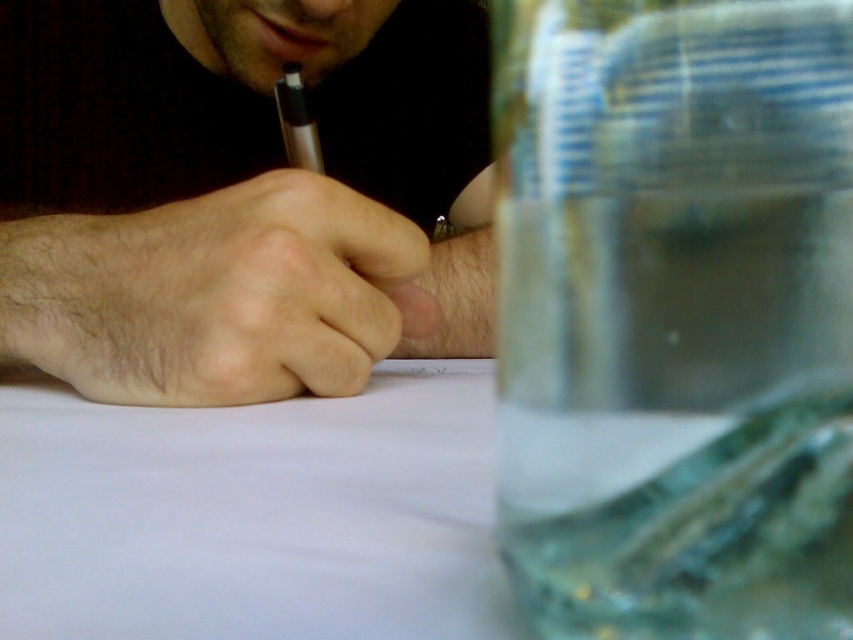
Looking at the image of hands and a pencil, which object is wider between the smooth skin hand at center and the metallic gold pencil at center?

The smooth skin hand at center is wider than the metallic gold pencil at center.

You have a small toy car that is 10 cm long. You want to place it on the transparent plastic jar at right or the white paper at center. Which surface can fit the toy car based on their widths?

The white paper at center has a greater width than the transparent plastic jar at right. Since the toy car is 10 cm long, it can fit on the white paper at center but may not fit on the transparent plastic jar at right due to its narrower width.